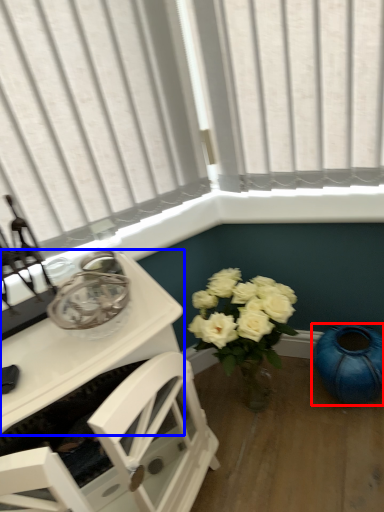
Question: Among these objects, which one is farthest to the camera, teal (highlighted by a red box) or table (highlighted by a blue box)?

Choices:
 (A) teal
 (B) table

Answer: (A)